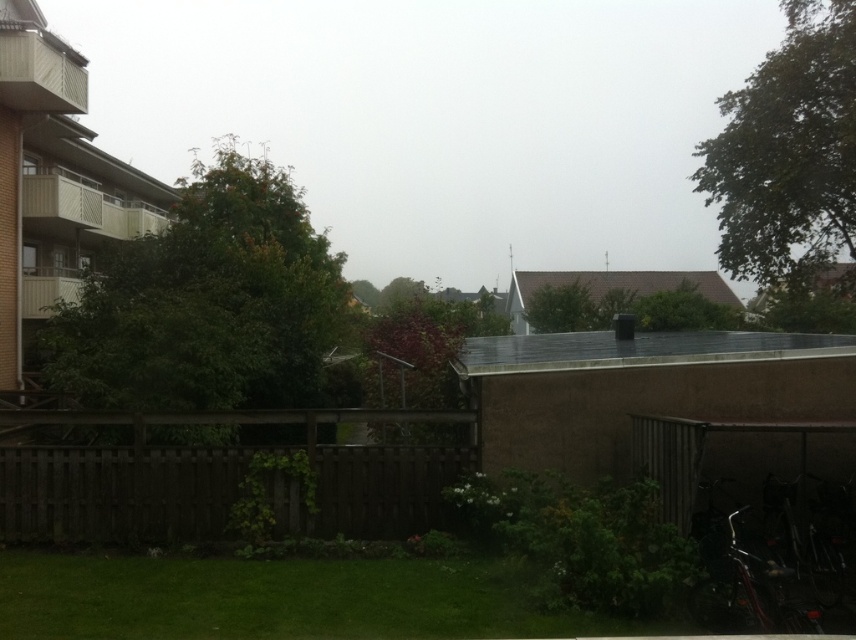
Between point (369, 154) and point (155, 506), which one is positioned in front?

Positioned in front is point (155, 506).

Is transparent fog at upper center further to the viewer compared to brown wooden fence at lower left?

Yes, transparent fog at upper center is behind brown wooden fence at lower left.

Identify the location of transparent fog at upper center. This screenshot has height=640, width=856. (441, 116).

Locate an element on the screen. transparent fog at upper center is located at coordinates (441, 116).